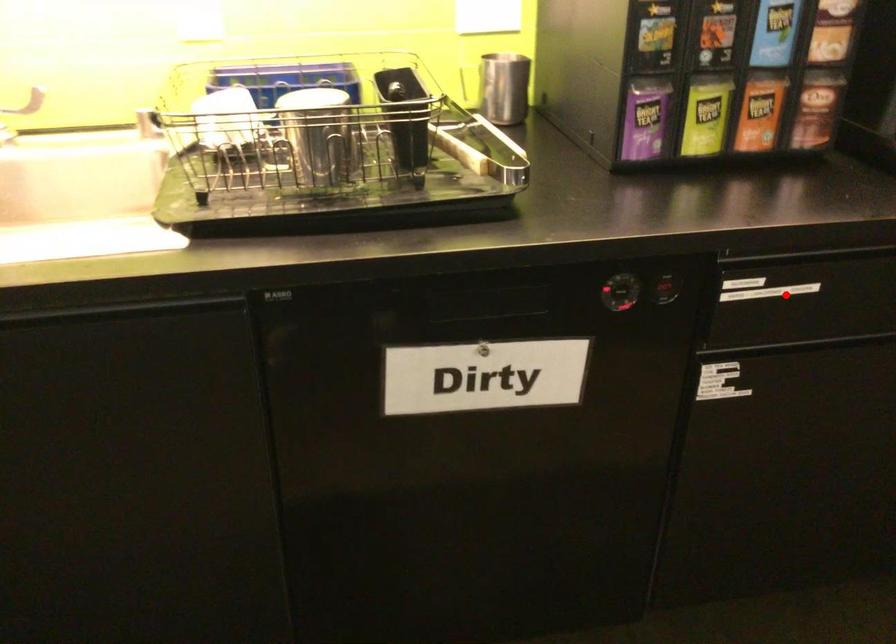
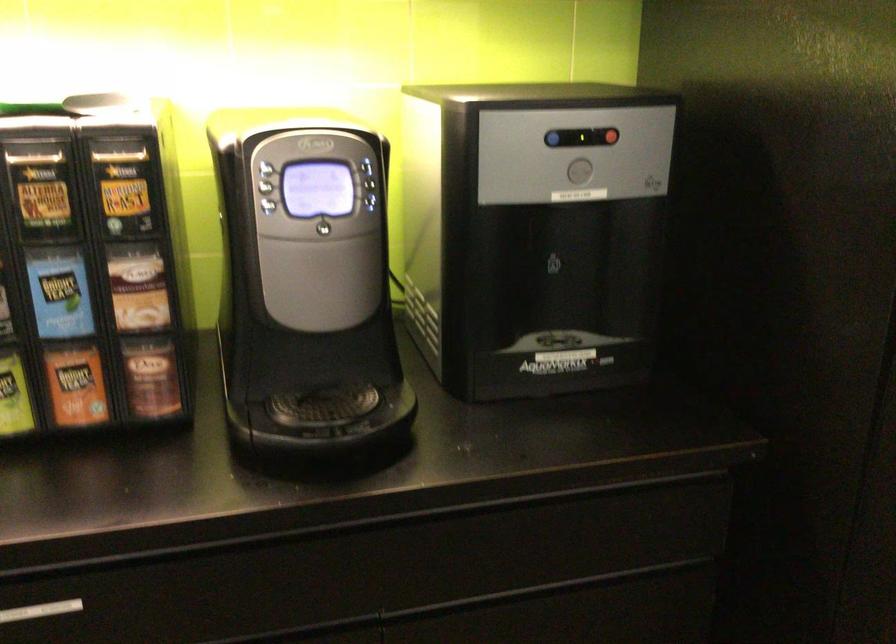
Where in the second image is the point corresponding to the highlighted location from the first image?

(40, 611)